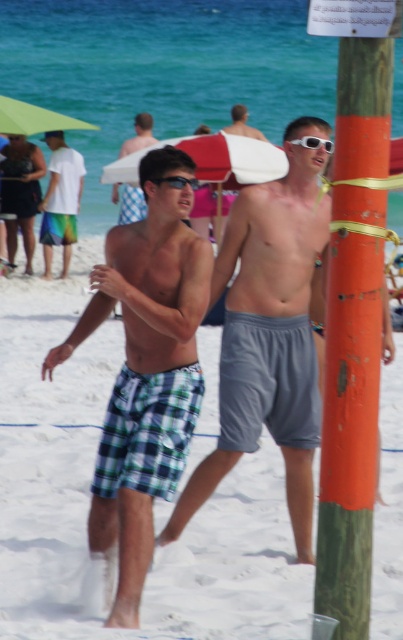
Question: Which point appears farthest from the camera in this image?

Choices:
 (A) (319, 145)
 (B) (64, 275)
 (C) (216, 417)
 (D) (166, 180)

Answer: (B)

Question: Is white cotton shirt at left closer to the viewer compared to white plastic goggles at center?

Choices:
 (A) yes
 (B) no

Answer: (B)

Question: Which object is positioned farthest from the white cotton shirt at left?

Choices:
 (A) black plastic sunglasses at center
 (B) white plastic goggles at center
 (C) plaid fabric shorts at center
 (D) green plaid shorts at center

Answer: (D)

Question: Considering the relative positions of green plaid shorts at center and checkered fabric shorts at center in the image provided, where is green plaid shorts at center located with respect to checkered fabric shorts at center?

Choices:
 (A) right
 (B) left

Answer: (B)

Question: Which of the following is the farthest from the observer?

Choices:
 (A) plaid fabric shorts at center
 (B) plaid shorts at center
 (C) black plastic sunglasses at center
 (D) white cotton shirt at left

Answer: (D)

Question: Does green plaid shorts at center appear on the left side of black plastic sunglasses at center?

Choices:
 (A) no
 (B) yes

Answer: (B)